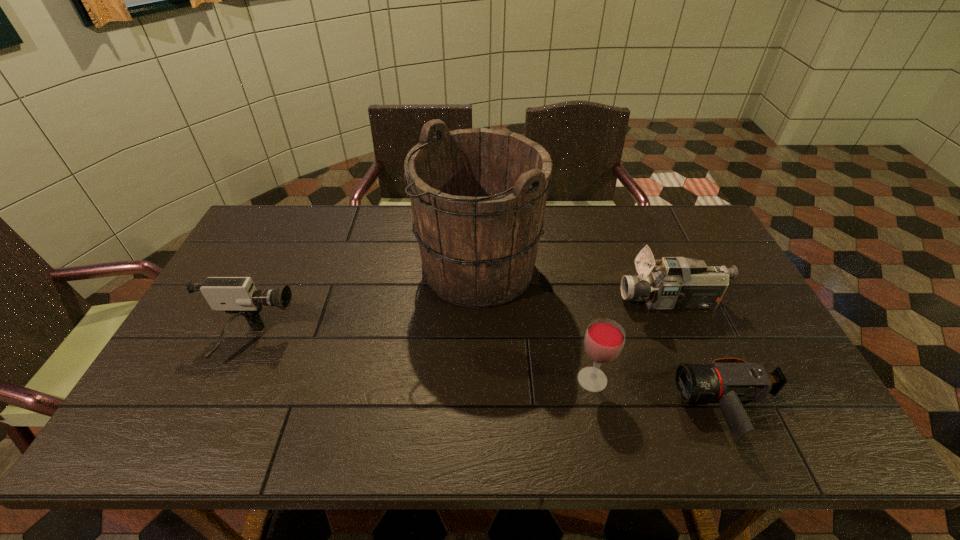
The height and width of the screenshot is (540, 960). Identify the location of vacant space located 0.340m on the lens of the nearest camcorder. (538, 407).

Where is `vacant region located 0.050m on the lens of the nearest camcorder`? vacant region located 0.050m on the lens of the nearest camcorder is located at coordinates (660, 407).

Where is `object that is at the far edge`? object that is at the far edge is located at coordinates (478, 196).

At what (x,y) coordinates should I click in order to perform the action: click on object that is at the near edge. Please return your answer as a coordinate pair (x, y). Looking at the image, I should click on (729, 381).

Locate an element on the screen. object positioned at the left edge is located at coordinates click(x=238, y=296).

You are a GUI agent. You are given a task and a screenshot of the screen. Output one action in this format:
    pyautogui.click(x=<x>, y=<y>)
    Task: Click on the object situated at the near right corner
    The image size is (960, 540).
    Given the screenshot: What is the action you would take?
    pyautogui.click(x=729, y=381)

In order to click on free space at the near edge of the desktop in this screenshot , I will do `click(229, 414)`.

Locate an element on the screen. The image size is (960, 540). vacant space at the left edge is located at coordinates (204, 346).

This screenshot has width=960, height=540. In order to click on blank space at the far left corner of the desktop in this screenshot , I will do `click(288, 209)`.

You are a GUI agent. You are given a task and a screenshot of the screen. Output one action in this format:
    pyautogui.click(x=<x>, y=<y>)
    Task: Click on the free space that is in between the leftmost camcorder and the tallest object
    
    Given the screenshot: What is the action you would take?
    pyautogui.click(x=365, y=306)